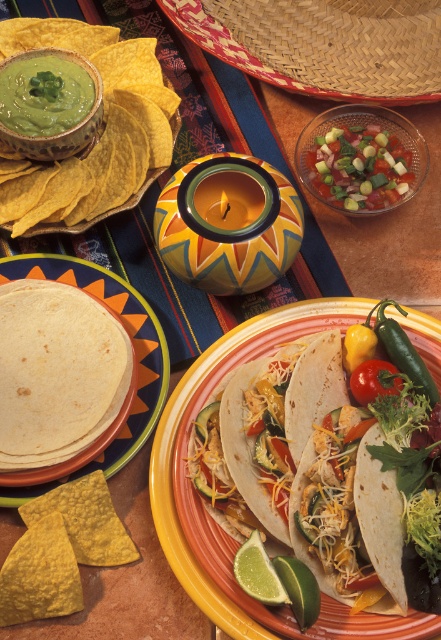
Can you confirm if matte tortilla at lower left is smaller than white flour tortilla at center?

Indeed, matte tortilla at lower left has a smaller size compared to white flour tortilla at center.

How much distance is there between matte tortilla at lower left and white flour tortilla at center?

matte tortilla at lower left is 14.37 centimeters away from white flour tortilla at center.

Which is behind, point (97, 406) or point (235, 484)?

The point (97, 406) is more distant.

Identify the location of matte tortilla at lower left. (56, 372).

Does matte tortilla at lower left have a larger size compared to green matte bowl at upper left?

Yes, matte tortilla at lower left is bigger than green matte bowl at upper left.

Which is below, matte tortilla at lower left or green matte bowl at upper left?

matte tortilla at lower left

Between point (60, 342) and point (52, 76), which one is positioned in front?

Point (60, 342) is in front.

Locate an element on the screen. matte tortilla at lower left is located at coordinates (56, 372).

Who is shorter, white tortilla at center or woven straw sombrero at upper center?

woven straw sombrero at upper center

Between point (220, 417) and point (185, 19), which one is positioned behind?

Positioned behind is point (185, 19).

Find the location of `white tortilla at center`. white tortilla at center is located at coordinates (287, 461).